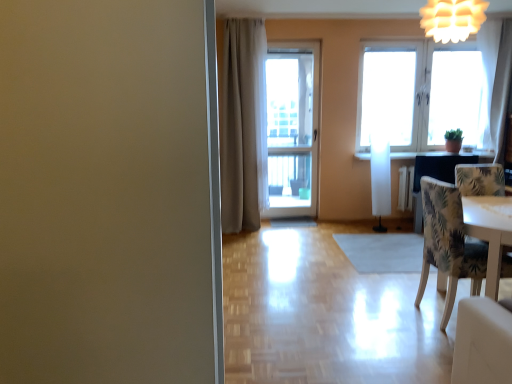
Question: Is white paper lantern at upper right positioned behind white glass door at center?

Choices:
 (A) no
 (B) yes

Answer: (A)

Question: Is white paper lantern at upper right wider than white glass door at center?

Choices:
 (A) yes
 (B) no

Answer: (A)

Question: Does white paper lantern at upper right appear on the left side of white glass door at center?

Choices:
 (A) yes
 (B) no

Answer: (B)

Question: Would you say white paper lantern at upper right contains white glass door at center?

Choices:
 (A) no
 (B) yes

Answer: (A)

Question: Is the surface of white paper lantern at upper right in direct contact with white glass door at center?

Choices:
 (A) yes
 (B) no

Answer: (B)

Question: Can you confirm if white paper lantern at upper right is positioned to the right of white glass door at center?

Choices:
 (A) no
 (B) yes

Answer: (B)

Question: Considering the relative positions of white glass window at upper right and white paper lantern at upper right in the image provided, is white glass window at upper right to the left of white paper lantern at upper right from the viewer's perspective?

Choices:
 (A) yes
 (B) no

Answer: (B)

Question: Considering the relative sizes of white glass window at upper right and white paper lantern at upper right in the image provided, is white glass window at upper right thinner than white paper lantern at upper right?

Choices:
 (A) no
 (B) yes

Answer: (B)

Question: From the image's perspective, is white glass window at upper right located above white paper lantern at upper right?

Choices:
 (A) no
 (B) yes

Answer: (A)

Question: From the image's perspective, is white glass window at upper right located beneath white paper lantern at upper right?

Choices:
 (A) no
 (B) yes

Answer: (B)

Question: Is white glass window at upper right at the right side of white paper lantern at upper right?

Choices:
 (A) yes
 (B) no

Answer: (A)

Question: Does white glass window at upper right lie in front of white paper lantern at upper right?

Choices:
 (A) no
 (B) yes

Answer: (A)

Question: Does white sheer curtain at upper right, which ranks as the 2th curtain in left-to-right order, appear on the right side of white paper lantern at upper right?

Choices:
 (A) yes
 (B) no

Answer: (A)